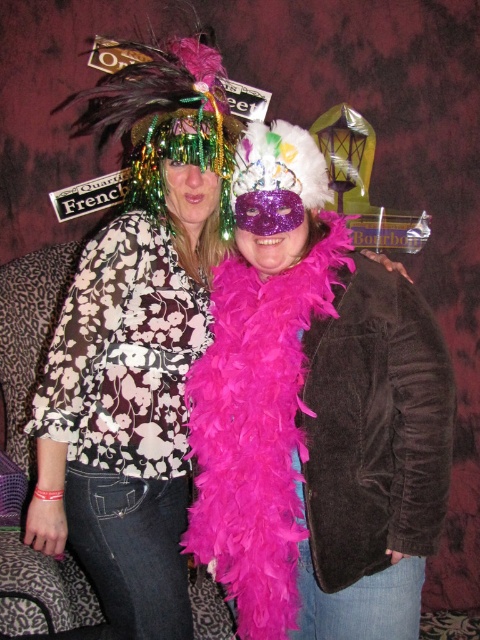
Looking at this image, you are a photographer setting up for a group photo. You have a 1.2 meter wide backdrop. The pink feather boa at center and the floral print blouse at left are both in the frame. Based on their widths, which object might require adjusting the camera angle to avoid cropping?

The pink feather boa at center might be wider than the floral print blouse at left, so adjusting the camera angle to accommodate its width could prevent cropping.